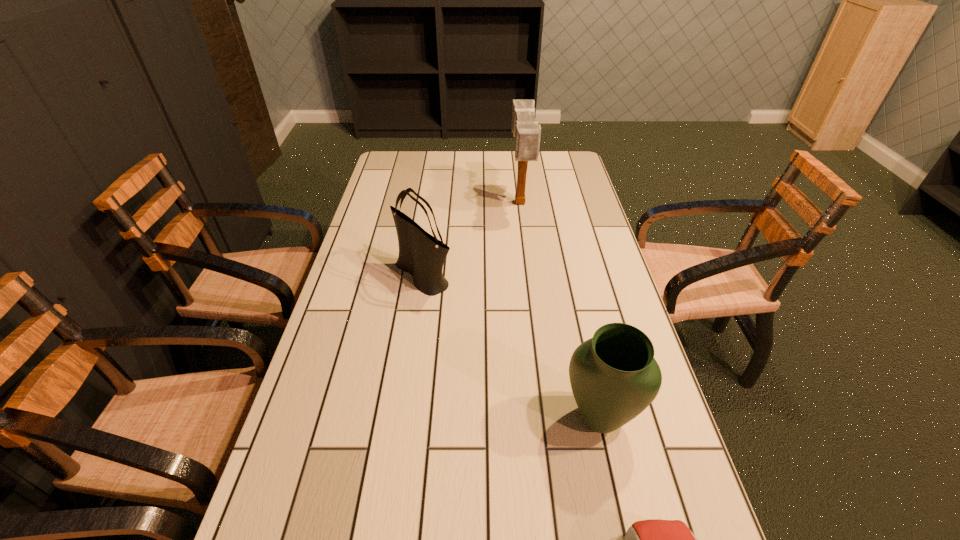
In the image, there is a desktop. Find the location of `free space at the far edge`. free space at the far edge is located at coordinates (480, 169).

In the image, there is a desktop. Where is `free space at the left edge`? The width and height of the screenshot is (960, 540). free space at the left edge is located at coordinates (359, 299).

In the image, there is a desktop. Identify the location of vacant space at the right edge. This screenshot has width=960, height=540. (573, 227).

Where is `vacant region at the far right corner of the desktop`? vacant region at the far right corner of the desktop is located at coordinates (565, 155).

Locate an element on the screen. This screenshot has width=960, height=540. vacant point located between the third nearest object and the third farthest object is located at coordinates (512, 347).

This screenshot has height=540, width=960. I want to click on vacant region between the shoulder bag and the second nearest object, so click(512, 347).

Image resolution: width=960 pixels, height=540 pixels. What are the coordinates of `free point between the second farthest object and the farthest object` in the screenshot? It's located at (471, 240).

Locate an element on the screen. The width and height of the screenshot is (960, 540). free space between the third tallest object and the leftmost object is located at coordinates (512, 347).

Image resolution: width=960 pixels, height=540 pixels. I want to click on vacant area that lies between the farthest object and the leftmost object, so click(471, 240).

The width and height of the screenshot is (960, 540). I want to click on free spot between the second farthest object and the farthest object, so click(x=471, y=240).